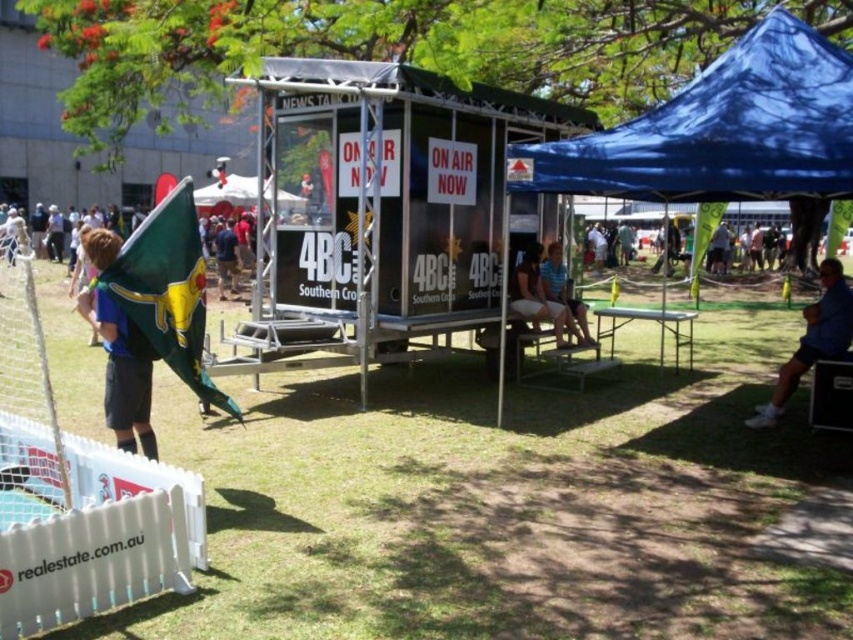
You are a photographer trying to capture both the blue jersey at left and the white fabric canopy at upper center in a single shot. Based on their positions, which object should you position closer to the left side of your camera frame to include both?

The blue jersey at left should be positioned closer to the left side of your camera frame since it is to the right of the white fabric canopy at upper center, meaning the canopy is actually to the left of the jersey. By placing the jersey on the left side of the frame, you can ensure both objects are captured.

You are organizing a small picnic and want to set up your blanket between the blue fabric tent at upper right and the white fabric canopy at upper center. Given that your picnic blanket is 2 meters wide, will there be enough space between them to place it without overlapping either structure?

The distance between the blue fabric tent at upper right and the white fabric canopy at upper center is 20.35 meters. Since your picnic blanket is only 2 meters wide, there is ample space to place it between them without overlapping either structure.

You are attending an outdoor event and want to stay out of the sun. You see the blue jersey at left and the white fabric canopy at upper center. Which object can provide shade?

The white fabric canopy at upper center can provide shade because it is positioned above the blue jersey at left, likely casting a shadow over it.